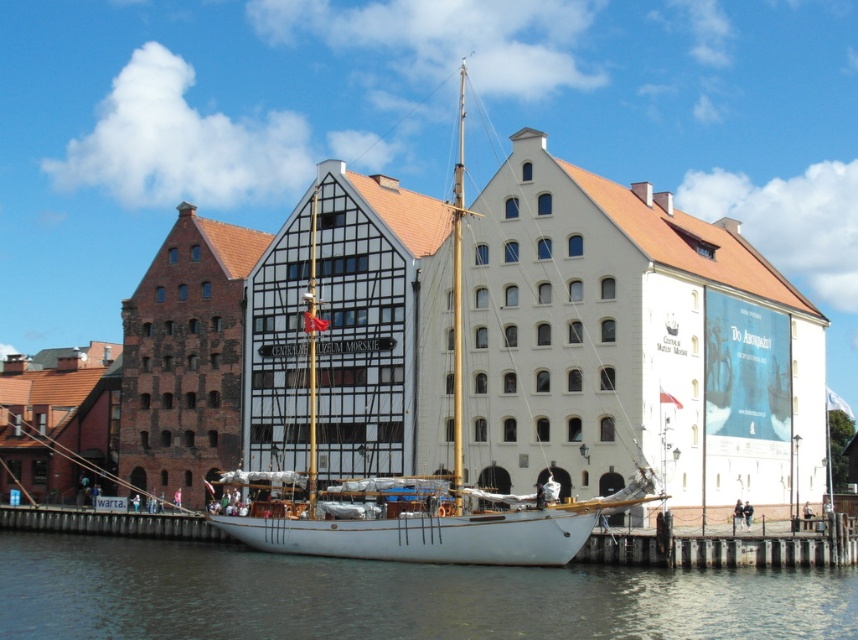
Who is more forward, [315,342] or [14,536]?

Point [315,342] is in front.

Does white matte sailboat at center appear over transparent water at lower center?

Yes, white matte sailboat at center is above transparent water at lower center.

Image resolution: width=858 pixels, height=640 pixels. Identify the location of white matte sailboat at center. (373, 410).

How far apart are white matte sailboat at center and wooden dock at lower center?

A distance of 17.72 meters exists between white matte sailboat at center and wooden dock at lower center.

Can you confirm if white matte sailboat at center is wider than wooden dock at lower center?

In fact, white matte sailboat at center might be narrower than wooden dock at lower center.

Describe the element at coordinates (373, 410) in the screenshot. I see `white matte sailboat at center` at that location.

The image size is (858, 640). I want to click on white matte sailboat at center, so 373,410.

Is transparent water at lower center to the left of wooden dock at lower center from the viewer's perspective?

Yes, transparent water at lower center is to the left of wooden dock at lower center.

Which of these two, transparent water at lower center or wooden dock at lower center, stands shorter?

With less height is wooden dock at lower center.

Locate an element on the screen. This screenshot has height=640, width=858. transparent water at lower center is located at coordinates (391, 595).